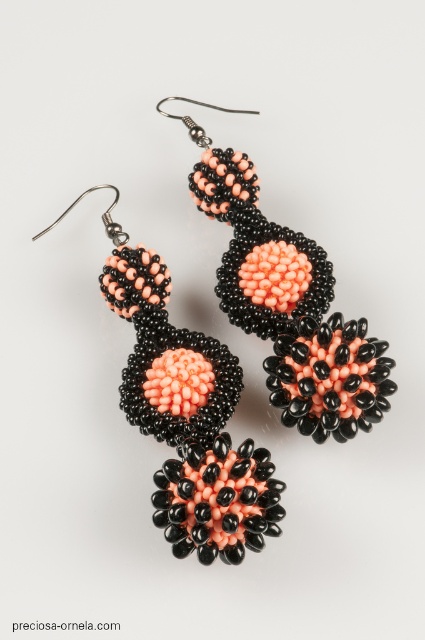
Question: Which point is closer to the camera?

Choices:
 (A) [295, 236]
 (B) [237, 499]

Answer: (B)

Question: Does coral matte/black beaded earrings at center appear under matte coral beads at center?

Choices:
 (A) no
 (B) yes

Answer: (B)

Question: Is coral matte/black beaded earrings at center positioned at the back of matte coral beads at center?

Choices:
 (A) yes
 (B) no

Answer: (B)

Question: Is coral matte/black beaded earrings at center above matte coral beads at center?

Choices:
 (A) no
 (B) yes

Answer: (A)